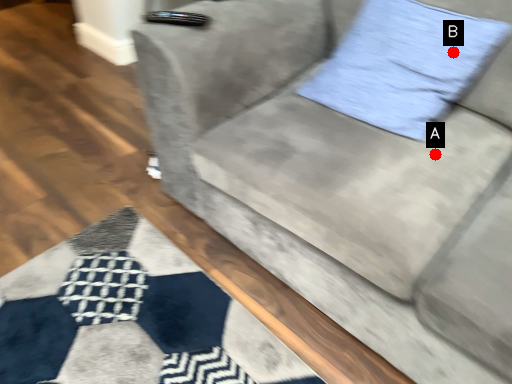
Question: Two points are circled on the image, labeled by A and B beside each circle. Which point appears farthest from the camera in this image?

Choices:
 (A) A is further
 (B) B is further

Answer: (B)